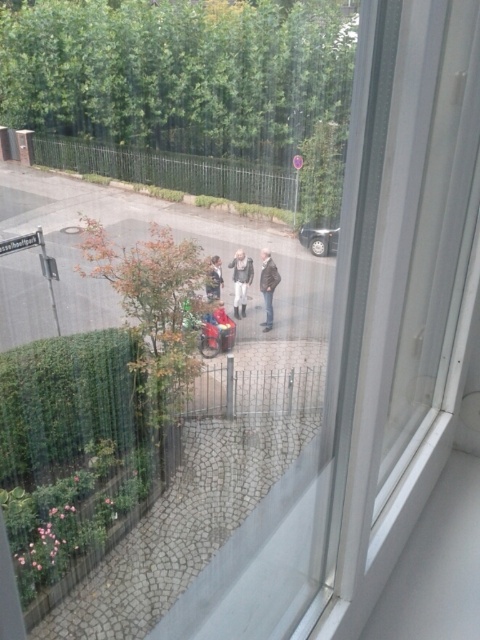
Question: From the image, what is the correct spatial relationship of shiny red motorcycle at center in relation to silver metallic car at center?

Choices:
 (A) left
 (B) right

Answer: (A)

Question: Estimate the real-world distances between objects in this image. Which object is closer to the leather jacket at center?

Choices:
 (A) light gray fabric jacket at center
 (B) dark gray jacket at center

Answer: (A)

Question: Which point is farther from the camera taking this photo?

Choices:
 (A) (262, 266)
 (B) (332, 253)

Answer: (B)

Question: Can you confirm if shiny red motorcycle at center is smaller than light gray fabric jacket at center?

Choices:
 (A) yes
 (B) no

Answer: (B)

Question: Which of these objects is positioned closest to the silver metallic car at center?

Choices:
 (A) shiny red motorcycle at center
 (B) dark gray jacket at center

Answer: (B)

Question: Considering the relative positions of shiny red motorcycle at center and dark gray jacket at center in the image provided, where is shiny red motorcycle at center located with respect to dark gray jacket at center?

Choices:
 (A) above
 (B) below

Answer: (B)